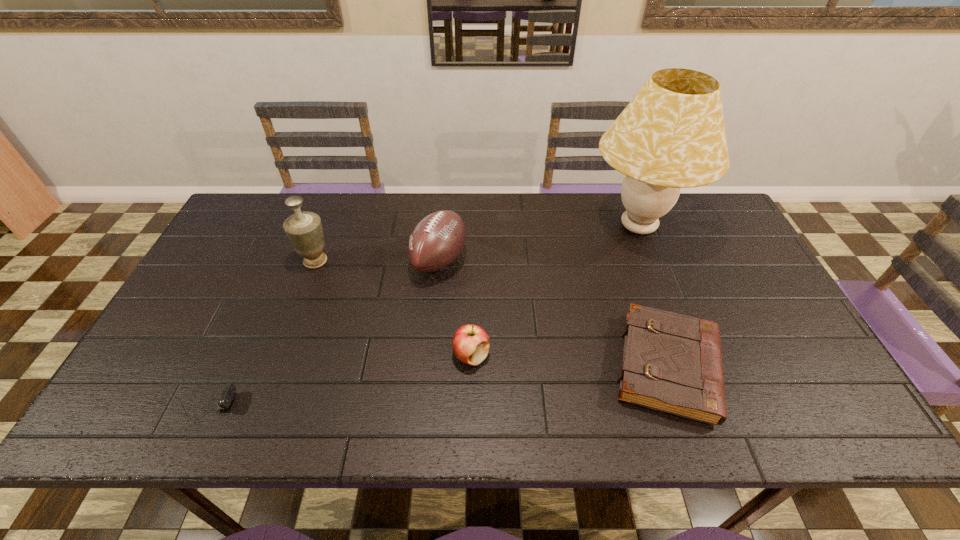
Find the location of a particular element. Image resolution: width=960 pixels, height=540 pixels. vacant position in the image that satisfies the following two spatial constraints: 1. on the front side of the football (American); 2. on the left side of the hardback book is located at coordinates (429, 367).

You are a GUI agent. You are given a task and a screenshot of the screen. Output one action in this format:
    pyautogui.click(x=<x>, y=<y>)
    Task: Click on the free space that satisfies the following two spatial constraints: 1. on the front side of the fifth object from right to left; 2. on the left side of the fourth tallest object
    The image size is (960, 540).
    Given the screenshot: What is the action you would take?
    pyautogui.click(x=280, y=355)